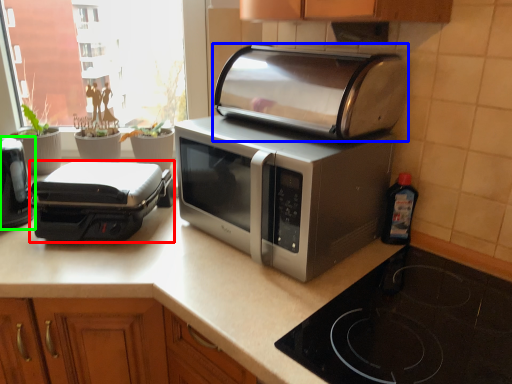
Question: Which object is positioned closest to toaster (highlighted by a red box)? Select from toaster (highlighted by a blue box) and toaster (highlighted by a green box).

Choices:
 (A) toaster
 (B) toaster

Answer: (B)